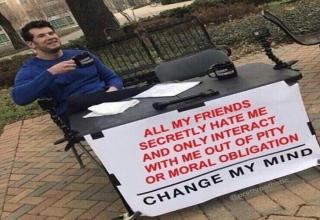
Locate an element on the screen. table is located at coordinates (245, 81).